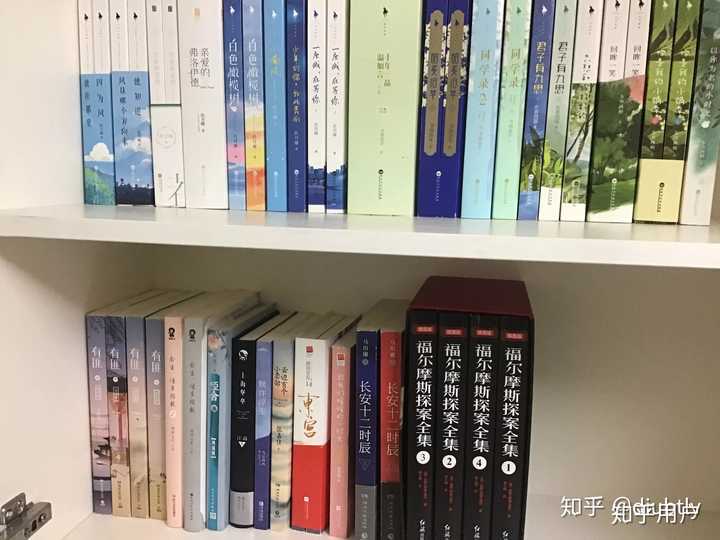
Locate an element on the screen. purple books is located at coordinates (96, 330), (112, 332), (135, 329), (148, 334).